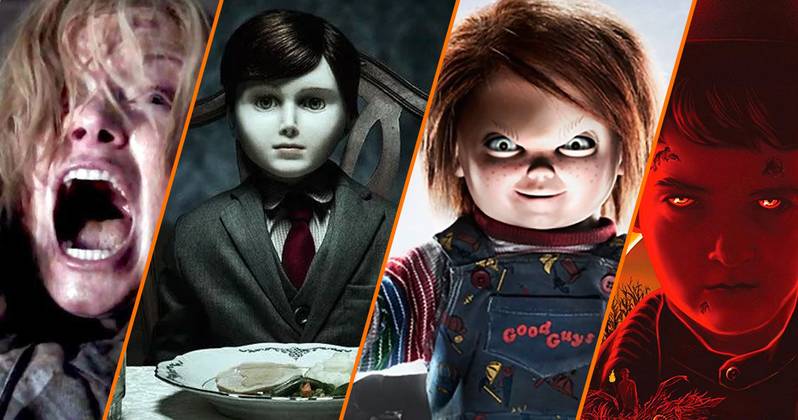
At what (x,y) coordinates should I click in order to perform the action: click on chair. Please return your answer as a coordinate pair (x, y). Looking at the image, I should click on (381, 121).